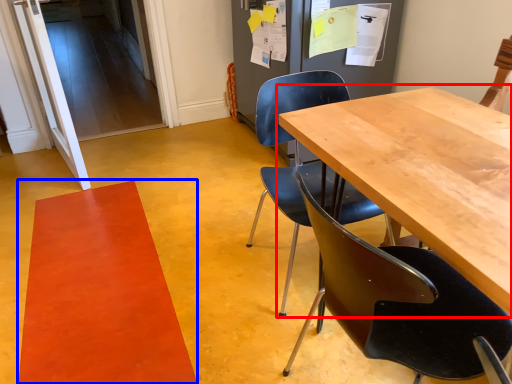
Question: Which object appears closest to the camera in this image, table (highlighted by a red box) or mat (highlighted by a blue box)?

Choices:
 (A) table
 (B) mat

Answer: (A)